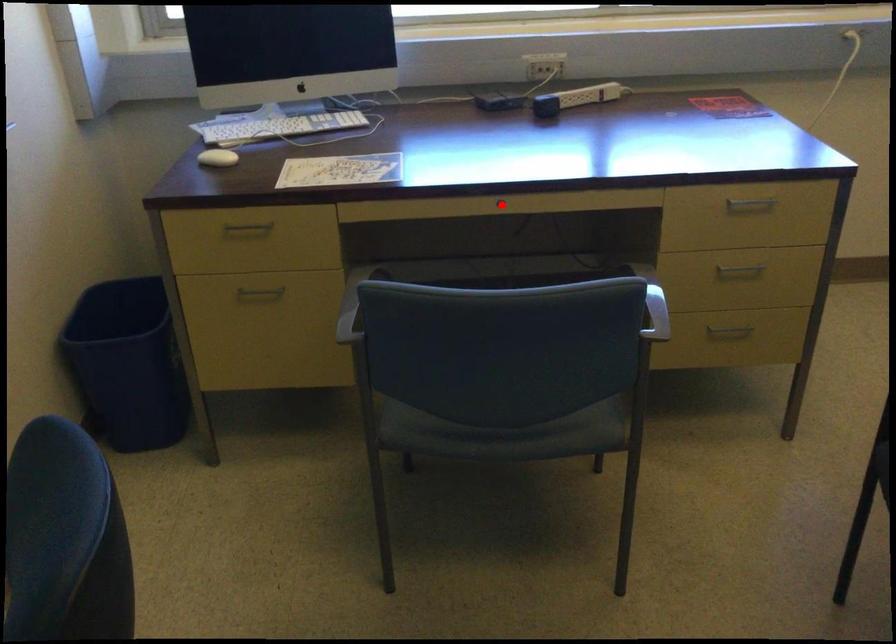
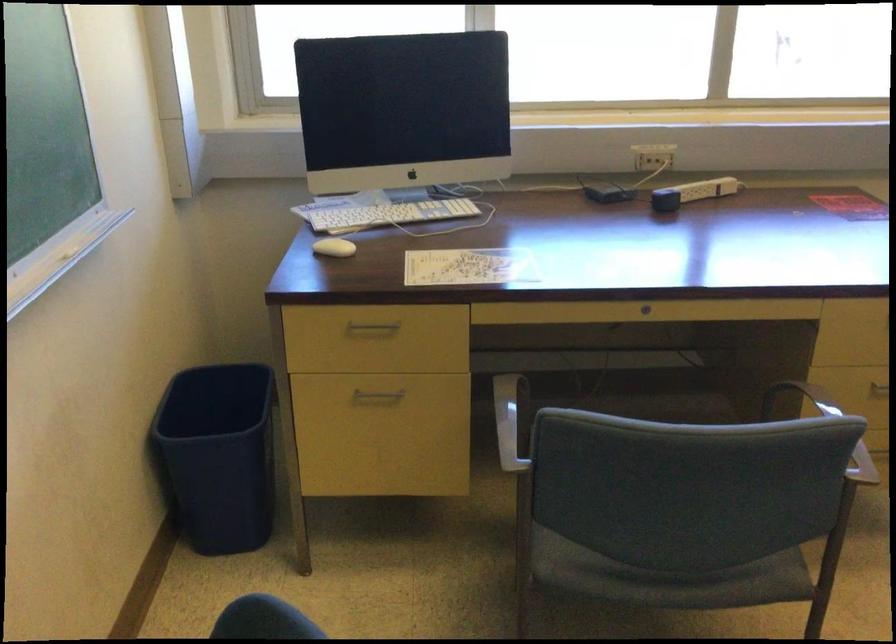
Find the pixel in the second image that matches the highlighted location in the first image.

(645, 308)